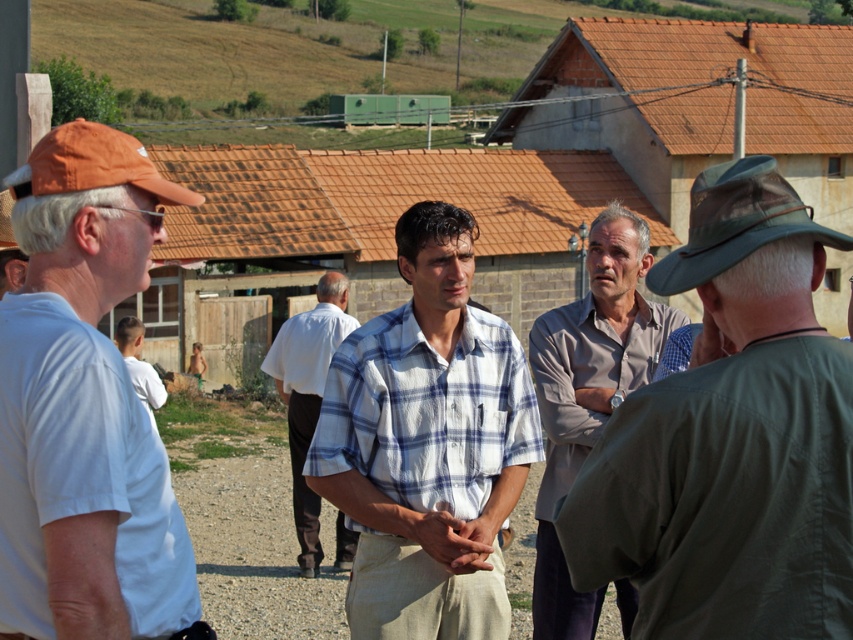
Question: Is white cotton shirt at left closer to the viewer compared to white shirt at lower left?

Choices:
 (A) no
 (B) yes

Answer: (B)

Question: Is white checkered shirt at center bigger than white shirt at lower left?

Choices:
 (A) no
 (B) yes

Answer: (A)

Question: Which point is farther from the camera taking this photo?

Choices:
 (A) (454, 205)
 (B) (657, 554)
 (C) (148, 365)

Answer: (C)

Question: Does plaid shirt at center have a larger size compared to gray cotton shirt at center?

Choices:
 (A) yes
 (B) no

Answer: (B)

Question: Which point appears closest to the camera in this image?

Choices:
 (A) (756, 465)
 (B) (366, 372)
 (C) (142, 364)
 (D) (297, 380)

Answer: (A)

Question: Which point is farther to the camera?

Choices:
 (A) gray cotton shirt at center
 (B) white cotton shirt at center
 (C) white shirt at lower left

Answer: (B)